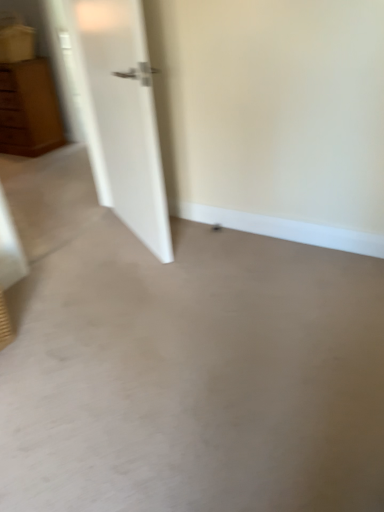
Question: Is matte brown chest of drawers at left positioned in front of beige matte concrete at center?

Choices:
 (A) yes
 (B) no

Answer: (B)

Question: Can you confirm if matte brown chest of drawers at left is smaller than beige matte concrete at center?

Choices:
 (A) yes
 (B) no

Answer: (B)

Question: Can you confirm if matte brown chest of drawers at left is thinner than beige matte concrete at center?

Choices:
 (A) no
 (B) yes

Answer: (B)

Question: From a real-world perspective, is matte brown chest of drawers at left physically above beige matte concrete at center?

Choices:
 (A) yes
 (B) no

Answer: (A)

Question: Does matte brown chest of drawers at left appear on the right side of beige matte concrete at center?

Choices:
 (A) no
 (B) yes

Answer: (A)

Question: Is matte brown chest of drawers at left not within beige matte concrete at center?

Choices:
 (A) yes
 (B) no

Answer: (A)

Question: Can you confirm if beige matte concrete at center is taller than matte brown chest of drawers at left?

Choices:
 (A) yes
 (B) no

Answer: (B)

Question: From a real-world perspective, is beige matte concrete at center below matte brown chest of drawers at left?

Choices:
 (A) yes
 (B) no

Answer: (A)

Question: Would you say beige matte concrete at center is a long distance from matte brown chest of drawers at left?

Choices:
 (A) yes
 (B) no

Answer: (A)

Question: Is beige matte concrete at center positioned beyond the bounds of matte brown chest of drawers at left?

Choices:
 (A) no
 (B) yes

Answer: (B)

Question: Is beige matte concrete at center oriented away from matte brown chest of drawers at left?

Choices:
 (A) yes
 (B) no

Answer: (B)

Question: From a real-world perspective, is beige matte concrete at center on top of matte brown chest of drawers at left?

Choices:
 (A) no
 (B) yes

Answer: (A)

Question: In terms of height, does matte brown chest of drawers at left look taller or shorter compared to beige matte concrete at center?

Choices:
 (A) short
 (B) tall

Answer: (B)